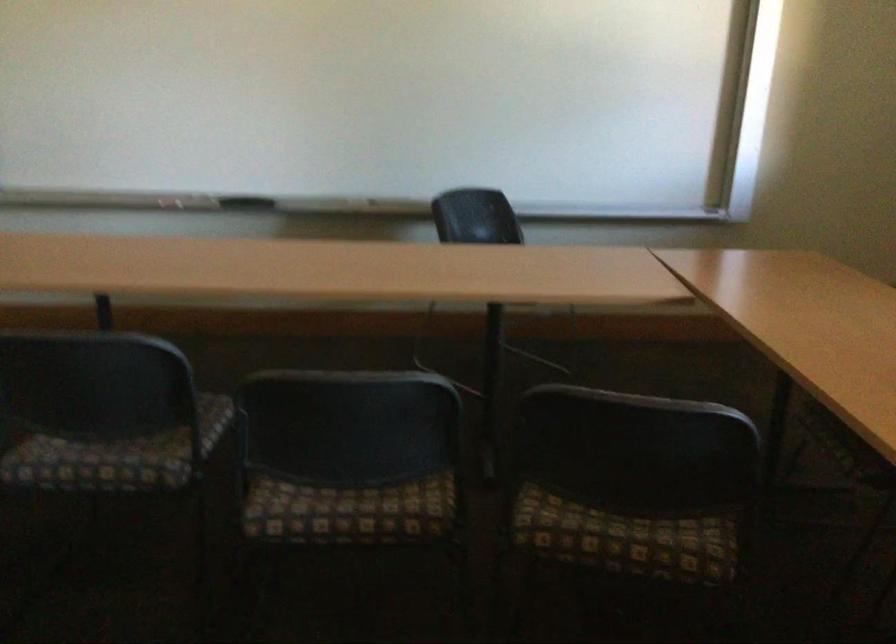
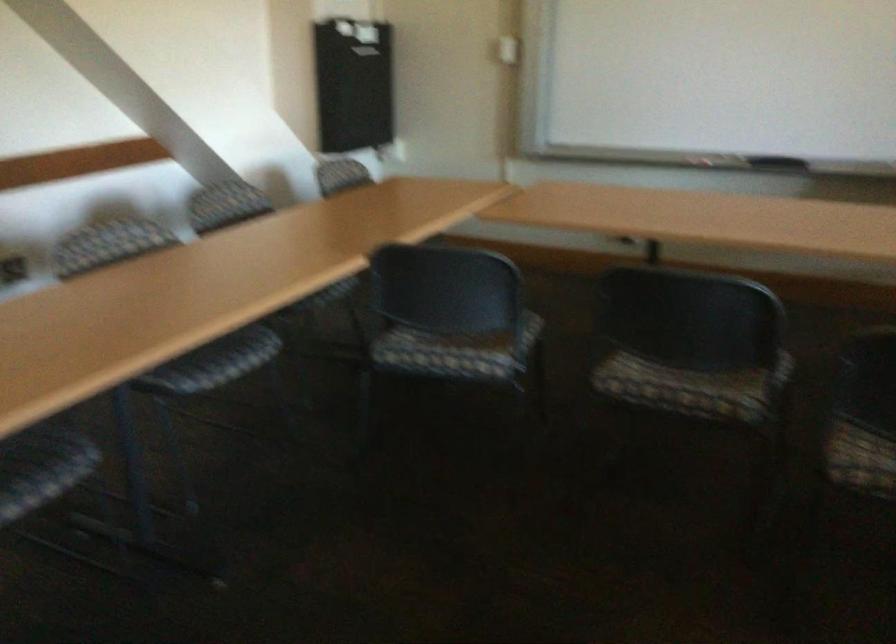
Locate, in the second image, the point that corresponds to [113,458] in the first image.

(691, 384)